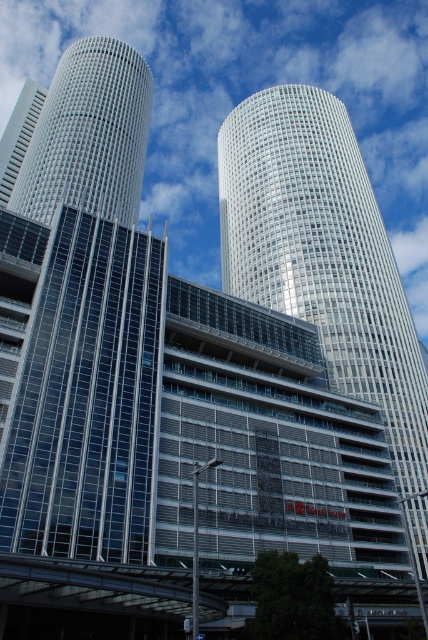
From the picture: You are an architect reviewing the city skyline. You need to determine the relative positions of the silver glass tower at center and the matte glass skyscraper at upper left. Which one is positioned lower in the image?

The silver glass tower at center is positioned lower than the matte glass skyscraper at upper left as it is described to be below it.

You are a drone operator tasked with flying a drone between two skyscrapers in the city. The drone has a maximum flight distance of 40 meters. Given the silver glass tower at center and the matte glass skyscraper at center, can the drone safely fly between them without exceeding its maximum range?

The silver glass tower at center and the matte glass skyscraper at center are 37.17 meters apart from each other. Since the drone has a maximum flight distance of 40 meters, it can safely fly between them as the distance between them is within the drone s range.

You are an architect evaluating the urban layout. You need to determine which of the two buildings, the silver glass tower at center or the matte glass skyscraper at upper left, has a greater horizontal extent. Based on the scene, which one is wider?

The silver glass tower at center has a greater width compared to the matte glass skyscraper at upper left, so it is wider.